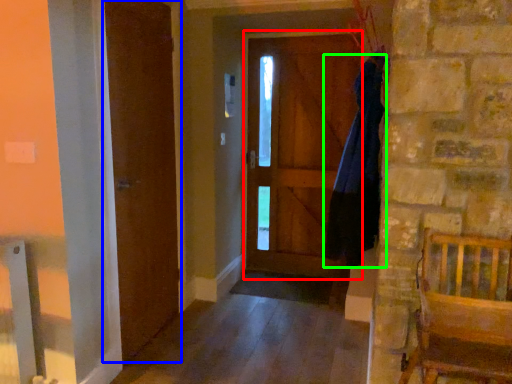
Question: Considering the real-world distances, which object is farthest from screen door (highlighted by a red box)? barn door (highlighted by a blue box) or dress (highlighted by a green box)?

Choices:
 (A) barn door
 (B) dress

Answer: (A)